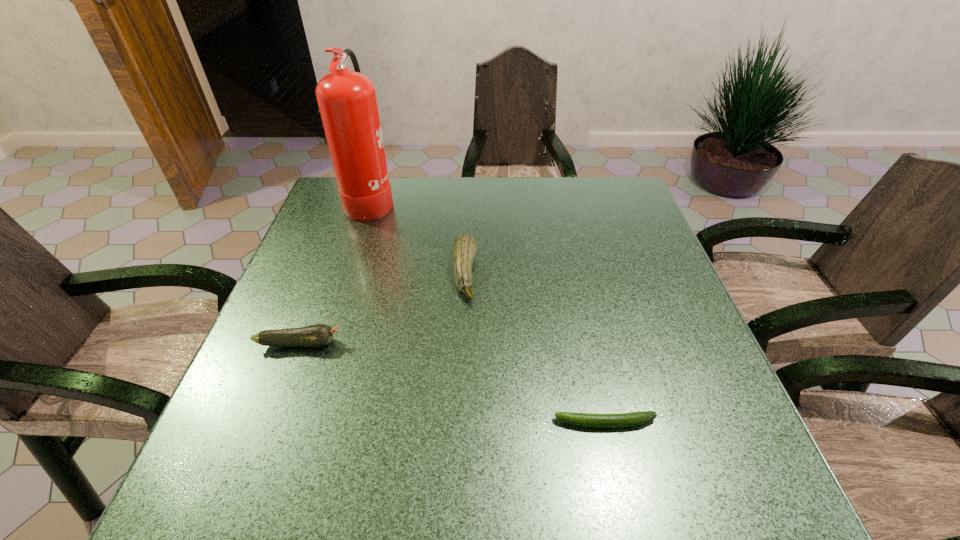
What are the coordinates of `free region at the near edge` in the screenshot? It's located at (330, 470).

Where is `free space at the left edge of the desktop`? free space at the left edge of the desktop is located at coordinates (311, 252).

Image resolution: width=960 pixels, height=540 pixels. In the image, there is a desktop. Find the location of `free space at the right edge`. free space at the right edge is located at coordinates (628, 286).

Locate an element on the screen. vacant space at the far right corner of the desktop is located at coordinates (607, 184).

Locate an element on the screen. vacant point at the near right corner is located at coordinates (757, 480).

Where is `vacant space in between the second shortest zucchini and the farthest zucchini`? The height and width of the screenshot is (540, 960). vacant space in between the second shortest zucchini and the farthest zucchini is located at coordinates (382, 308).

Where is `unoccupied area between the fire extinguisher and the second tallest object`? The width and height of the screenshot is (960, 540). unoccupied area between the fire extinguisher and the second tallest object is located at coordinates (418, 236).

The width and height of the screenshot is (960, 540). I want to click on free point between the rightmost object and the tallest object, so click(x=488, y=311).

Locate an element on the screen. free point between the farthest object and the nearest zucchini is located at coordinates tap(488, 311).

Locate an element on the screen. The width and height of the screenshot is (960, 540). blank region between the shortest object and the third farthest object is located at coordinates [x=452, y=383].